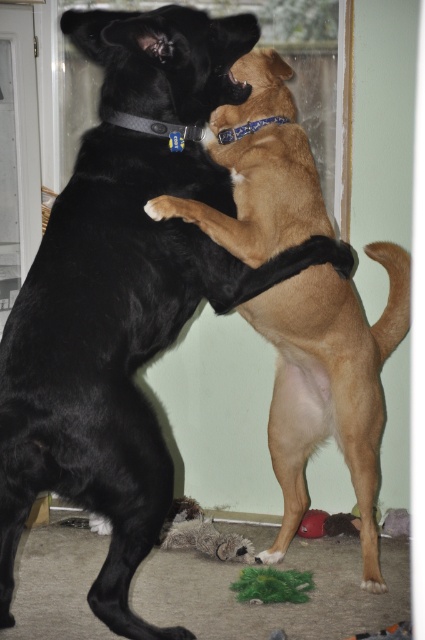
Question: Which point is farther to the camera?

Choices:
 (A) transparent glass screen door at left
 (B) brown furry dog at center

Answer: (A)

Question: Which object appears closest to the camera in this image?

Choices:
 (A) brown furry dog at center
 (B) transparent glass screen door at left

Answer: (A)

Question: Is brown furry dog at center to the left of transparent glass screen door at left from the viewer's perspective?

Choices:
 (A) yes
 (B) no

Answer: (B)

Question: Does brown furry dog at center appear on the right side of transparent glass screen door at left?

Choices:
 (A) yes
 (B) no

Answer: (A)

Question: Does brown furry dog at center have a larger size compared to transparent glass screen door at left?

Choices:
 (A) no
 (B) yes

Answer: (B)